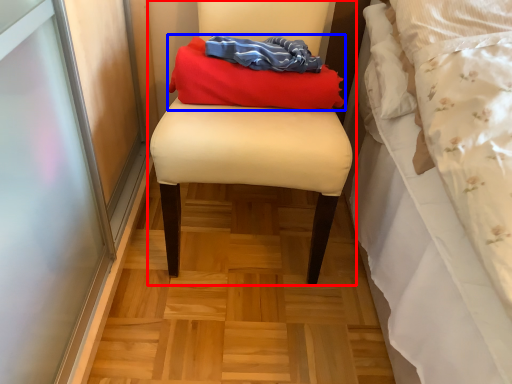
Question: Which point is further to the camera, furniture (highlighted by a red box) or laundry (highlighted by a blue box)?

Choices:
 (A) furniture
 (B) laundry

Answer: (B)